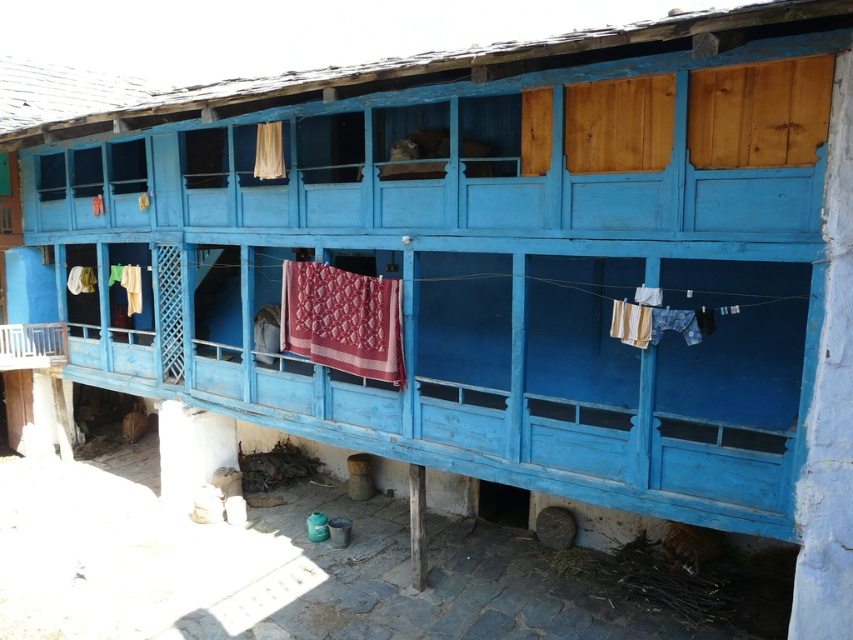
Can you confirm if quilted fabric at center is bigger than matte white curtain at upper center?

Yes.

Is point (376, 376) positioned behind point (260, 160)?

No, it is in front of (260, 160).

What do you see at coordinates (343, 320) in the screenshot?
I see `quilted fabric at center` at bounding box center [343, 320].

The width and height of the screenshot is (853, 640). Identify the location of quilted fabric at center. (343, 320).

Can you confirm if wooden balcony at lower left is thinner than matte white curtain at upper center?

No, wooden balcony at lower left is not thinner than matte white curtain at upper center.

Does wooden balcony at lower left appear over matte white curtain at upper center?

Incorrect, wooden balcony at lower left is not positioned above matte white curtain at upper center.

Is point (6, 365) positioned in front of point (281, 124)?

No.

You are a GUI agent. You are given a task and a screenshot of the screen. Output one action in this format:
    pyautogui.click(x=<x>, y=<y>)
    Task: Click on the wooden balcony at lower left
    
    Given the screenshot: What is the action you would take?
    pyautogui.click(x=32, y=346)

In the scene shown: Does quilted fabric at center have a smaller size compared to wooden balcony at lower left?

No, quilted fabric at center is not smaller than wooden balcony at lower left.

Is quilted fabric at center positioned before wooden balcony at lower left?

Yes, quilted fabric at center is in front of wooden balcony at lower left.

Which is in front, point (366, 323) or point (62, 355)?

Point (366, 323) is more forward.

Locate an element on the screen. The image size is (853, 640). quilted fabric at center is located at coordinates (343, 320).